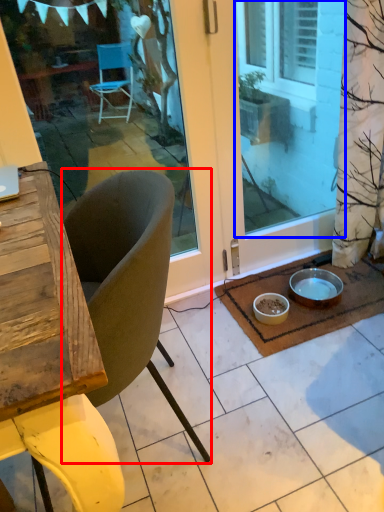
Question: Among these objects, which one is nearest to the camera, chair (highlighted by a red box) or window screen (highlighted by a blue box)?

Choices:
 (A) chair
 (B) window screen

Answer: (A)